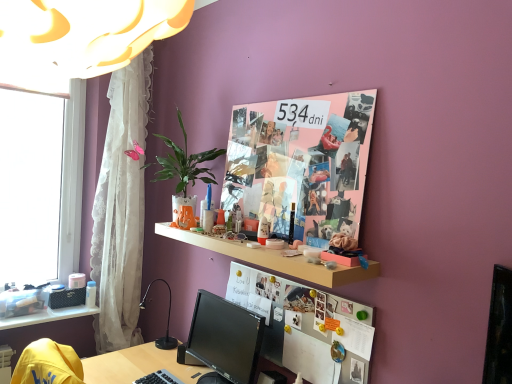
Question: Is white plastic window at left outside of wooden shelf at center, marked as the 1th shelf in a right-to-left arrangement?

Choices:
 (A) no
 (B) yes

Answer: (B)

Question: Can you see white plastic window at left touching wooden shelf at center, placed as the first shelf when sorted from top to bottom?

Choices:
 (A) yes
 (B) no

Answer: (B)

Question: Is white plastic window at left shorter than wooden shelf at center, positioned as the 2th shelf in back-to-front order?

Choices:
 (A) no
 (B) yes

Answer: (A)

Question: From the image's perspective, would you say white plastic window at left is shown under wooden shelf at center, placed as the first shelf when sorted from top to bottom?

Choices:
 (A) no
 (B) yes

Answer: (A)

Question: Is wooden shelf at center, the 2th shelf positioned from the bottom, a part of white plastic window at left?

Choices:
 (A) no
 (B) yes

Answer: (A)

Question: Is white plastic window at left bigger than wooden shelf at center, marked as the 1th shelf in a right-to-left arrangement?

Choices:
 (A) no
 (B) yes

Answer: (B)

Question: Is wooden shelf at center, marked as the 1th shelf in a right-to-left arrangement, beside clear plastic storage at lower left, the second shelf positioned from the top?

Choices:
 (A) no
 (B) yes

Answer: (A)

Question: Is wooden shelf at center, placed as the first shelf when sorted from top to bottom, completely or partially outside of clear plastic storage at lower left, the second shelf positioned from the top?

Choices:
 (A) yes
 (B) no

Answer: (A)

Question: From a real-world perspective, is wooden shelf at center, marked as the 1th shelf in a right-to-left arrangement, located beneath clear plastic storage at lower left, arranged as the 1th shelf when viewed from the left?

Choices:
 (A) yes
 (B) no

Answer: (B)

Question: Can you confirm if wooden shelf at center, marked as the 1th shelf in a right-to-left arrangement, is smaller than clear plastic storage at lower left, which is the first shelf in back-to-front order?

Choices:
 (A) yes
 (B) no

Answer: (B)

Question: Is wooden shelf at center, the 2th shelf positioned from the bottom, looking in the opposite direction of clear plastic storage at lower left, the second shelf positioned from the top?

Choices:
 (A) yes
 (B) no

Answer: (B)

Question: Is wooden shelf at center, marked as the 2th shelf in a left-to-right arrangement, aimed at clear plastic storage at lower left, the second shelf positioned from the top?

Choices:
 (A) yes
 (B) no

Answer: (B)

Question: Considering the relative positions of clear plastic storage at lower left, the first shelf from the bottom, and whiteboard at center in the image provided, is clear plastic storage at lower left, the first shelf from the bottom, to the left of whiteboard at center from the viewer's perspective?

Choices:
 (A) yes
 (B) no

Answer: (A)